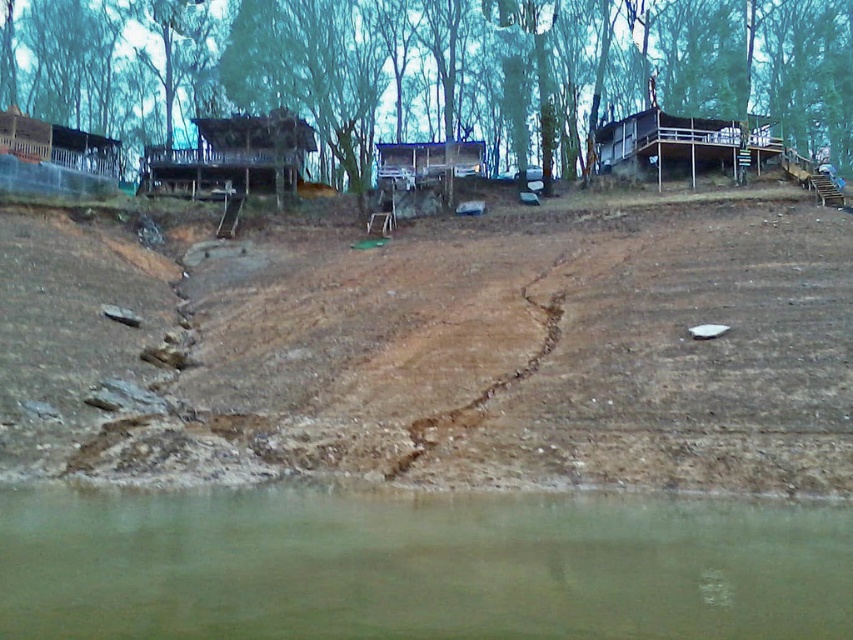
Question: Which of the following is the closest to the observer?

Choices:
 (A) (515, 499)
 (B) (381, 148)

Answer: (A)

Question: Which object is farther from the camera taking this photo?

Choices:
 (A) brown wooden hut at center
 (B) brown sandy dirt field at lower left
 (C) wooden cabin at left

Answer: (A)

Question: Is the position of wooden cabin at upper right more distant than that of wooden cabin at center?

Choices:
 (A) no
 (B) yes

Answer: (A)

Question: Is brown sandy dirt field at lower left behind wooden cabin at left?

Choices:
 (A) no
 (B) yes

Answer: (A)

Question: Which point appears farthest from the camera in this image?

Choices:
 (A) (412, 182)
 (B) (708, 419)

Answer: (A)

Question: Can you confirm if brown sandy dirt field at lower left is positioned below brown muddy water at lower center?

Choices:
 (A) yes
 (B) no

Answer: (B)